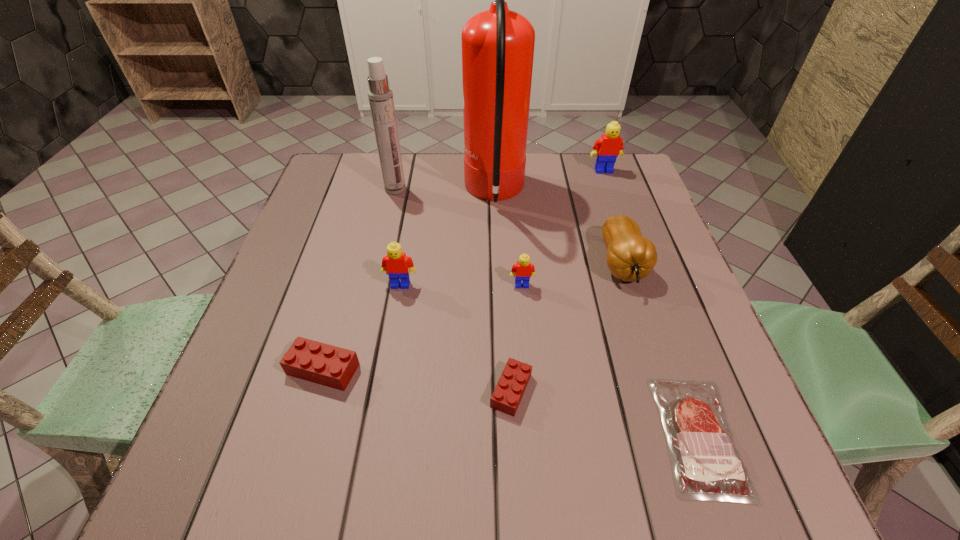
Where is `object situated at the near edge`? This screenshot has height=540, width=960. object situated at the near edge is located at coordinates (705, 461).

Locate an element on the screen. The height and width of the screenshot is (540, 960). object situated at the left edge is located at coordinates (324, 364).

This screenshot has width=960, height=540. What are the coordinates of `Lego positioned at the right edge` in the screenshot? It's located at (607, 148).

I want to click on gourd that is at the right edge, so (630, 257).

The image size is (960, 540). Find the location of `steak positioned at the right edge`. steak positioned at the right edge is located at coordinates (705, 461).

Image resolution: width=960 pixels, height=540 pixels. Identify the location of object present at the far right corner. (607, 148).

You are a GUI agent. You are given a task and a screenshot of the screen. Output one action in this format:
    pyautogui.click(x=<x>, y=<y>)
    Task: Click on the object located in the near right corner section of the desktop
    This screenshot has width=960, height=540.
    Given the screenshot: What is the action you would take?
    click(705, 461)

Image resolution: width=960 pixels, height=540 pixels. Find the location of `free location at the far edge`. free location at the far edge is located at coordinates (558, 175).

Where is `free space at the near edge`? Image resolution: width=960 pixels, height=540 pixels. free space at the near edge is located at coordinates (483, 460).

Where is `vacant space at the left edge of the desktop`? The height and width of the screenshot is (540, 960). vacant space at the left edge of the desktop is located at coordinates (307, 209).